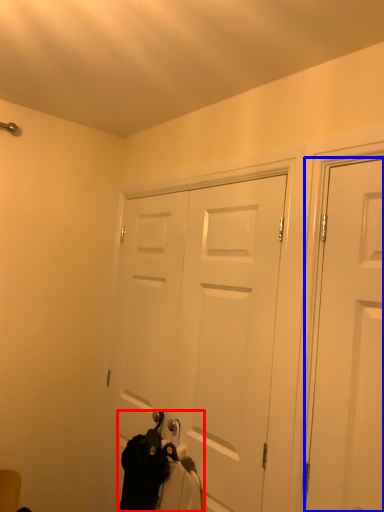
Question: Which of the following is the farthest to the observer, laundry (highlighted by a red box) or door (highlighted by a blue box)?

Choices:
 (A) laundry
 (B) door

Answer: (A)